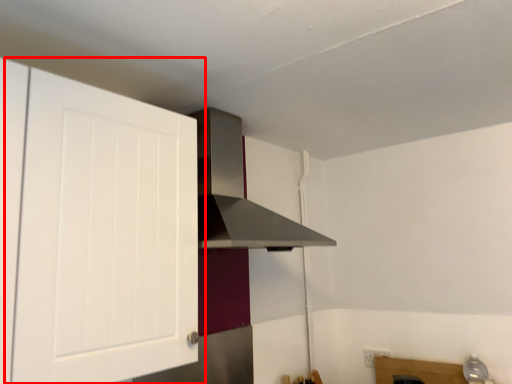
Question: From the image's perspective, what is the correct spatial positioning of cabinetry (annotated by the red box) in reference to vent?

Choices:
 (A) above
 (B) below

Answer: (B)